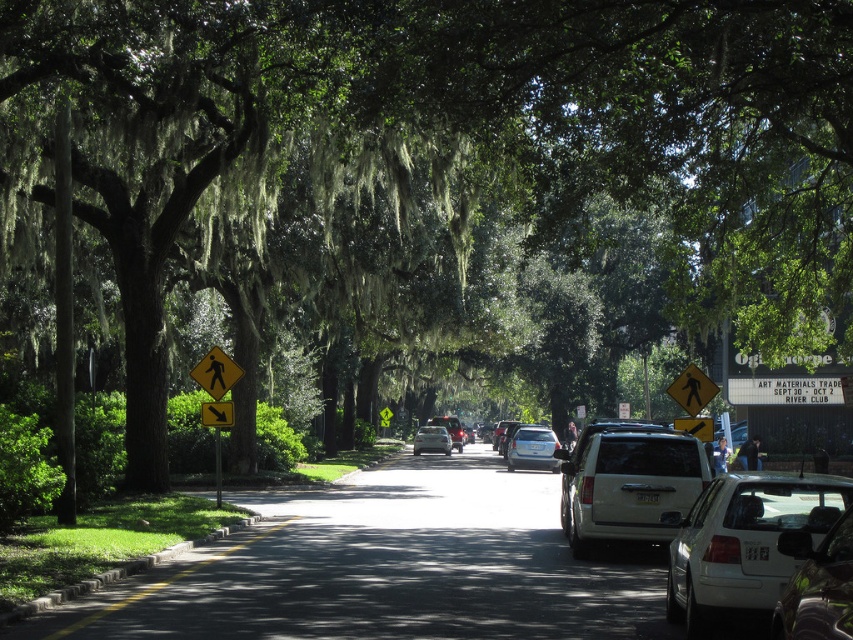
Question: Is shiny silver car at center to the right of yellow plastic pedestrian crossing sign at left from the viewer's perspective?

Choices:
 (A) yes
 (B) no

Answer: (A)

Question: In this image, where is yellow reflective plastic pedestrian crossing sign at left located relative to silver metallic sedan at center?

Choices:
 (A) left
 (B) right

Answer: (A)

Question: Based on their relative distances, which object is farther from the yellow painted curb at lower left?

Choices:
 (A) yellow reflective pedestrian crossing sign at center
 (B) satin silver sedan at center
 (C) shiny silver car at center

Answer: (B)

Question: Is shiny silver car at center further to camera compared to yellow plastic pedestrian crossing sign at center?

Choices:
 (A) yes
 (B) no

Answer: (B)

Question: Estimate the real-world distances between objects in this image. Which object is farther from the white matte suv at center?

Choices:
 (A) yellow plastic pedestrian crossing sign at left
 (B) silver metallic sedan at center

Answer: (B)

Question: Which of the following is the closest to the observer?

Choices:
 (A) satin silver sedan at center
 (B) silver metallic sedan at center

Answer: (A)